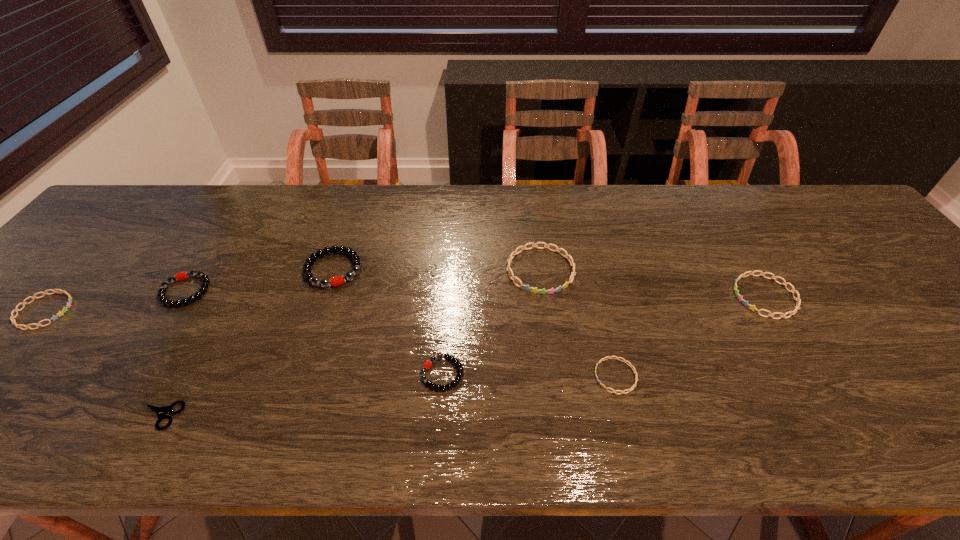
Locate an element on the screen. This screenshot has width=960, height=540. the smallest black bracelet is located at coordinates (427, 365).

Locate an element on the screen. the smallest blue bracelet is located at coordinates (608, 357).

The width and height of the screenshot is (960, 540). Identify the location of the nearest blue bracelet. pyautogui.click(x=608, y=357).

You are a GUI agent. You are given a task and a screenshot of the screen. Output one action in this format:
    pyautogui.click(x=<x>, y=<y>)
    Task: Click on the nearest object
    The image size is (960, 540).
    Given the screenshot: What is the action you would take?
    pyautogui.click(x=161, y=412)

Identify the location of shears. (161, 412).

Where is `free region located on the surface of the biggest blue bracelet showing star-shaped elements`? free region located on the surface of the biggest blue bracelet showing star-shaped elements is located at coordinates (558, 398).

Where is `vacant region located 0.230m on the right of the second black bracelet from left to right`? Image resolution: width=960 pixels, height=540 pixels. vacant region located 0.230m on the right of the second black bracelet from left to right is located at coordinates (449, 269).

Find the location of `free region located on the surface of the second biggest blue bracelet showing star-shaped elements`. free region located on the surface of the second biggest blue bracelet showing star-shaped elements is located at coordinates (659, 296).

The width and height of the screenshot is (960, 540). Find the location of `vacant area situated 0.290m on the surface of the second biggest blue bracelet showing star-shaped elements`. vacant area situated 0.290m on the surface of the second biggest blue bracelet showing star-shaped elements is located at coordinates (618, 296).

Image resolution: width=960 pixels, height=540 pixels. In order to click on vacant position located on the surface of the second biggest blue bracelet showing star-shaped elements in this screenshot , I will do `click(679, 296)`.